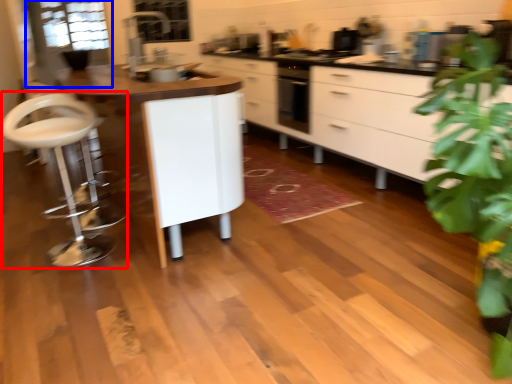
Question: Which of the following is the farthest to the observer, swivel chair (highlighted by a red box) or glass door (highlighted by a blue box)?

Choices:
 (A) swivel chair
 (B) glass door

Answer: (B)